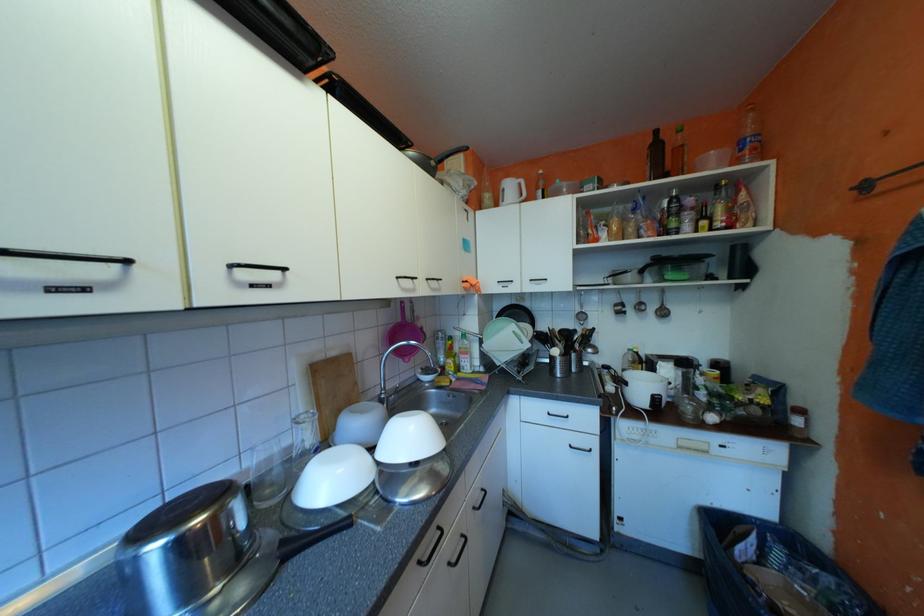
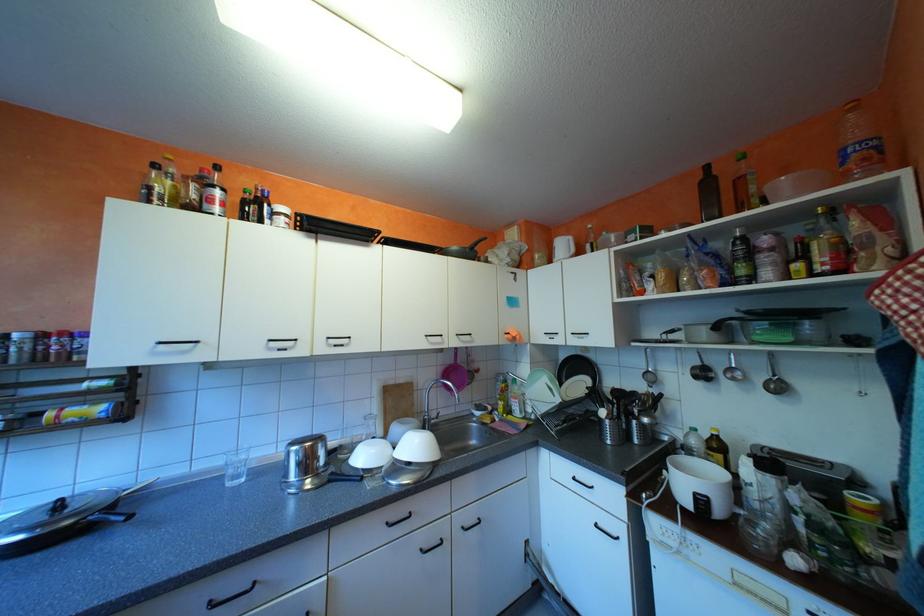
Question: How did the camera likely rotate?

Choices:
 (A) Left
 (B) Right
 (C) Up
 (D) Down

Answer: (A)